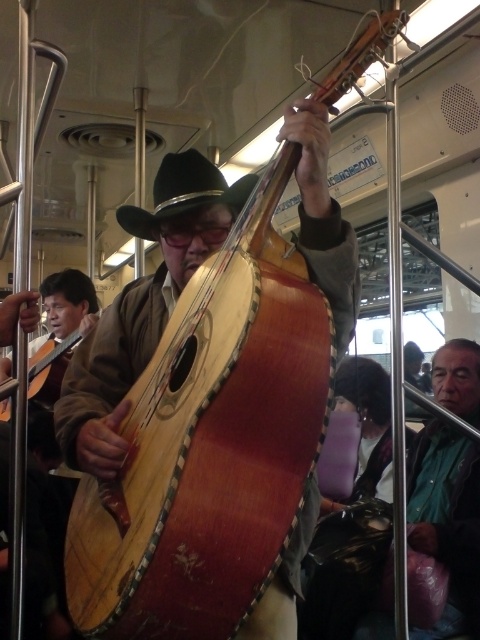
Question: Which point is farther from the camera taking this photo?

Choices:
 (A) (163, 170)
 (B) (147, 374)

Answer: (A)

Question: Does wooden carved cello at center have a lesser width compared to black felt fedora at center?

Choices:
 (A) no
 (B) yes

Answer: (A)

Question: Which point appears closest to the camera in this image?

Choices:
 (A) (190, 211)
 (B) (229, 403)

Answer: (B)

Question: Does wooden carved cello at center have a lesser width compared to black felt fedora at center?

Choices:
 (A) no
 (B) yes

Answer: (A)

Question: Does wooden carved cello at center have a smaller size compared to black felt fedora at center?

Choices:
 (A) no
 (B) yes

Answer: (A)